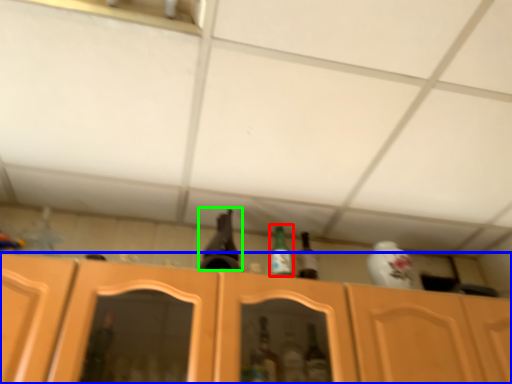
Question: Which object is positioned closest to bottle (highlighted by a red box)? Select from cabinetry (highlighted by a blue box) and beer bottle (highlighted by a green box).

Choices:
 (A) cabinetry
 (B) beer bottle

Answer: (B)